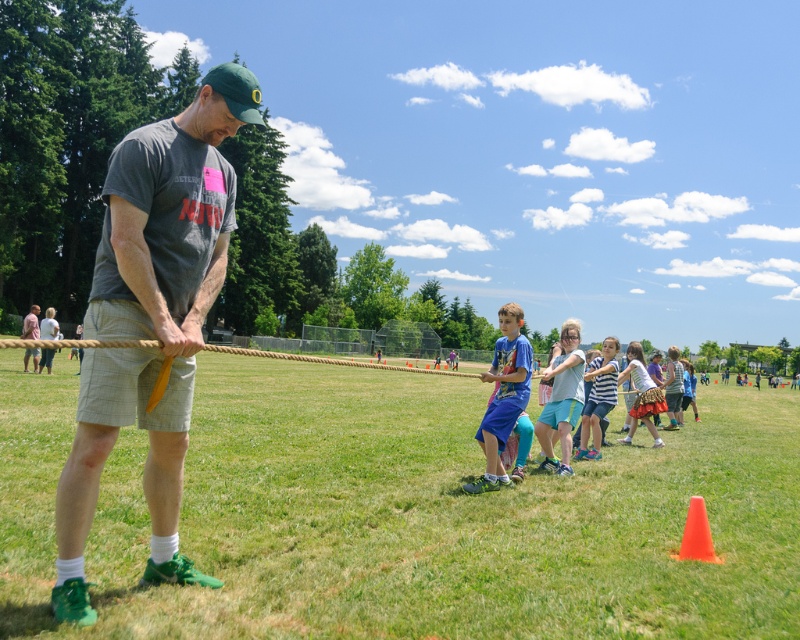
Which is more to the left, striped cotton shirt at center or striped fabric skirt at center?

striped cotton shirt at center

Is striped cotton shirt at center further to camera compared to striped fabric skirt at center?

No, striped cotton shirt at center is closer to the viewer.

Identify the location of striped cotton shirt at center. This screenshot has height=640, width=800. click(598, 397).

Image resolution: width=800 pixels, height=640 pixels. Find the location of `striped cotton shirt at center`. striped cotton shirt at center is located at coordinates (598, 397).

Does point (194, 275) come behind point (654, 440)?

No, (194, 275) is in front of (654, 440).

Is matte gray t-shirt at center wider than striped fabric skirt at center?

No.

Which is in front, point (138, 420) or point (662, 442)?

Point (138, 420) is in front.

You are a GUI agent. You are given a task and a screenshot of the screen. Output one action in this format:
    pyautogui.click(x=<x>, y=<y>)
    Task: Click on the matte gray t-shirt at center
    This screenshot has height=640, width=800.
    Given the screenshot: What is the action you would take?
    pyautogui.click(x=152, y=321)

Is blue cotton shirt at center taller than light blue denim shorts at center?

Indeed, blue cotton shirt at center has a greater height compared to light blue denim shorts at center.

Does blue cotton shirt at center appear on the left side of light blue denim shorts at center?

Indeed, blue cotton shirt at center is positioned on the left side of light blue denim shorts at center.

Is point (528, 376) in front of point (564, 333)?

Yes, it is.

You are a GUI agent. You are given a task and a screenshot of the screen. Output one action in this format:
    pyautogui.click(x=<x>, y=<y>)
    Task: Click on the blue cotton shirt at center
    This screenshot has width=800, height=640.
    Given the screenshot: What is the action you would take?
    pyautogui.click(x=504, y=396)